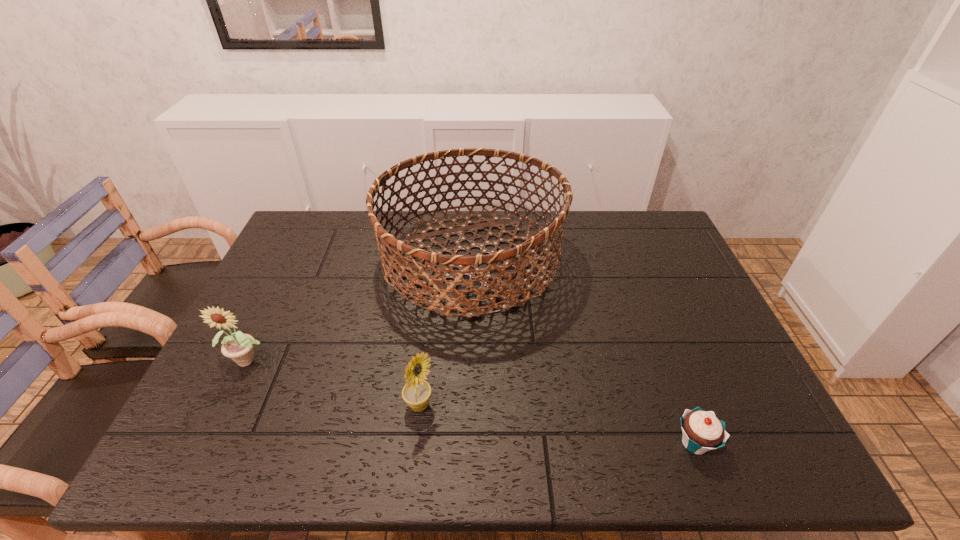
This screenshot has width=960, height=540. What are the coordinates of `blank space at the right edge` in the screenshot? It's located at (728, 391).

At what (x,y) coordinates should I click in order to perform the action: click on blank area at the far right corner. Please return your answer as a coordinate pair (x, y). Image resolution: width=960 pixels, height=540 pixels. Looking at the image, I should click on (662, 238).

Identify the location of blank space at the near right corner. (754, 435).

Image resolution: width=960 pixels, height=540 pixels. I want to click on unoccupied position between the leftmost object and the third tallest object, so click(x=335, y=382).

What are the coordinates of `blank region between the leftmost object and the farthest object` in the screenshot? It's located at coord(360,310).

Find the location of a particular element. empty space that is in between the right sunflower and the farther sunflower is located at coordinates (335, 382).

Find the location of `free space between the left sunflower and the nearest object`. free space between the left sunflower and the nearest object is located at coordinates (472, 401).

Where is `free space between the tallest object and the nearer sunflower`? free space between the tallest object and the nearer sunflower is located at coordinates (445, 333).

Identify the location of free area in between the tallest object and the nearest object. (583, 352).

The height and width of the screenshot is (540, 960). In order to click on free space between the farther sunflower and the tallest object in this screenshot , I will do `click(360, 310)`.